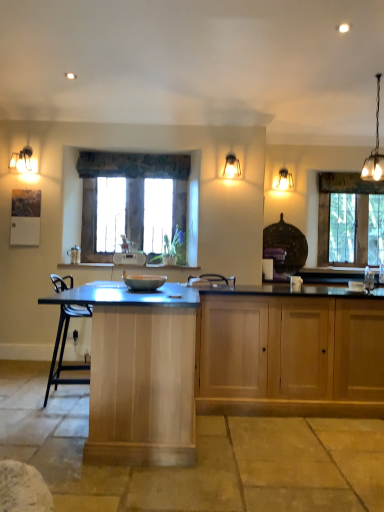
Question: Is matte gray bowl at center bigger or smaller than wooden cabinet at lower right, which is the second cabinetry in left-to-right order?

Choices:
 (A) big
 (B) small

Answer: (B)

Question: From the image's perspective, relative to wooden cabinet at lower right, which is the second cabinetry in left-to-right order, is matte gray bowl at center above or below?

Choices:
 (A) below
 (B) above

Answer: (B)

Question: Which object is the closest to the metallic chandelier at upper right?

Choices:
 (A) matte glass pendant light at upper right, the first lamp when ordered from back to front
 (B) matte glass lampshade at upper center, which is counted as the 2th lamp, starting from the front
 (C) matte gray bowl at center
 (D) clear glass window at right, which is counted as the 2th window, starting from the front
 (E) light wood cabinet at center, marked as the 2th cabinetry in a right-to-left arrangement

Answer: (D)

Question: Considering the real-world distances, which object is closest to the light wood cabinet at center, which is the first cabinetry in left-to-right order?

Choices:
 (A) metallic chandelier at upper right
 (B) matte gray bowl at center
 (C) matte white pendant light at upper left, the 1th lamp from the front
 (D) wooden window at center, which appears as the first window when viewed from the front
 (E) matte glass lampshade at upper center, the 2th lamp from the right

Answer: (B)